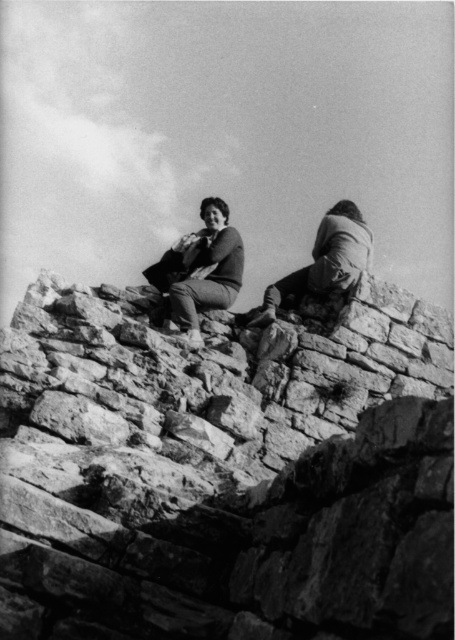
Based on the scene described, which object occupies more space in the image? Please consider the rough stone wall at center and the smooth fabric jacket at upper right in your answer.

The smooth fabric jacket at upper right occupies more space in the image than the rough stone wall at center according to the description provided.